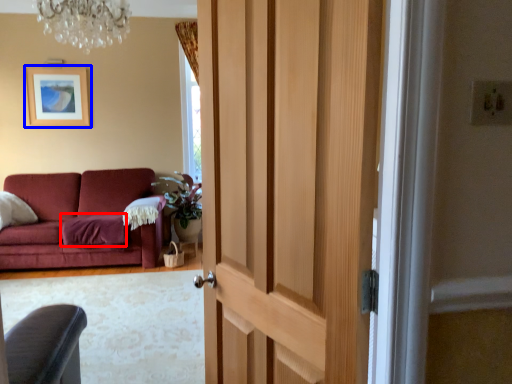
Question: Among these objects, which one is farthest to the camera, blanket (highlighted by a red box) or picture frame (highlighted by a blue box)?

Choices:
 (A) blanket
 (B) picture frame

Answer: (B)